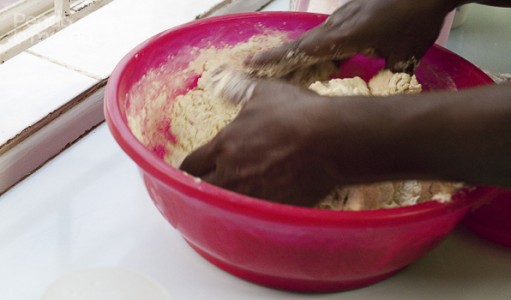
In order to click on counter in this screenshot , I will do 127,240.